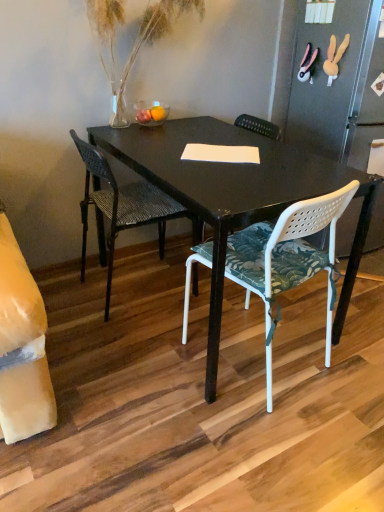
The image size is (384, 512). Find the location of `black woven chair at center, the 2th chair viewed from the right`. black woven chair at center, the 2th chair viewed from the right is located at coordinates (122, 206).

Image resolution: width=384 pixels, height=512 pixels. Describe the element at coordinates (122, 206) in the screenshot. I see `black woven chair at center, the 2th chair viewed from the right` at that location.

Measure the distance between point (101, 207) and camera.

2.01 meters.

What is the approximate height of white plastic chair with floral cushion at center, which ranks as the second chair in left-to-right order?

white plastic chair with floral cushion at center, which ranks as the second chair in left-to-right order, is 30.84 inches in height.

Measure the distance between point [327,364] and camera.

The depth of point [327,364] is 5.59 feet.

How much space does white plastic chair with floral cushion at center, which ranks as the second chair in left-to-right order, occupy horizontally?

white plastic chair with floral cushion at center, which ranks as the second chair in left-to-right order, is 20.03 inches in width.

Describe the element at coordinates (287, 258) in the screenshot. I see `white plastic chair with floral cushion at center, which ranks as the second chair in left-to-right order` at that location.

Identify the location of white plastic chair with floral cushion at center, which ranks as the second chair in left-to-right order. This screenshot has height=512, width=384. 287,258.

Where is `black woven chair at center, the 2th chair viewed from the right`? This screenshot has width=384, height=512. black woven chair at center, the 2th chair viewed from the right is located at coordinates (122, 206).

Can you confirm if black woven chair at center, the 2th chair viewed from the right, is positioned to the left of white plastic chair with floral cushion at center, which ranks as the second chair in left-to-right order?

Correct, you'll find black woven chair at center, the 2th chair viewed from the right, to the left of white plastic chair with floral cushion at center, which ranks as the second chair in left-to-right order.

Which object is more forward, black woven chair at center, placed as the 1th chair when sorted from left to right, or white plastic chair with floral cushion at center, which ranks as the second chair in left-to-right order?

Positioned in front is white plastic chair with floral cushion at center, which ranks as the second chair in left-to-right order.

Does point (176, 203) come behind point (334, 219)?

Yes, it is behind point (334, 219).

Looking at this image, from the image's perspective, is black woven chair at center, placed as the 1th chair when sorted from left to right, located beneath white plastic chair with floral cushion at center, which appears as the 1th chair when viewed from the right?

Actually, black woven chair at center, placed as the 1th chair when sorted from left to right, appears above white plastic chair with floral cushion at center, which appears as the 1th chair when viewed from the right, in the image.

From a real-world perspective, between black woven chair at center, the 2th chair viewed from the right, and white plastic chair with floral cushion at center, which ranks as the second chair in left-to-right order, who is vertically lower?

In real-world perspective, black woven chair at center, the 2th chair viewed from the right, is lower.

Which object is wider, black woven chair at center, placed as the 1th chair when sorted from left to right, or white plastic chair with floral cushion at center, which appears as the 1th chair when viewed from the right?

white plastic chair with floral cushion at center, which appears as the 1th chair when viewed from the right.

Can you confirm if black woven chair at center, placed as the 1th chair when sorted from left to right, is shorter than white plastic chair with floral cushion at center, which appears as the 1th chair when viewed from the right?

No, black woven chair at center, placed as the 1th chair when sorted from left to right, is not shorter than white plastic chair with floral cushion at center, which appears as the 1th chair when viewed from the right.

In terms of size, does black woven chair at center, placed as the 1th chair when sorted from left to right, appear bigger or smaller than white plastic chair with floral cushion at center, which appears as the 1th chair when viewed from the right?

black woven chair at center, placed as the 1th chair when sorted from left to right, is smaller than white plastic chair with floral cushion at center, which appears as the 1th chair when viewed from the right.

Can we say black woven chair at center, placed as the 1th chair when sorted from left to right, lies outside white plastic chair with floral cushion at center, which ranks as the second chair in left-to-right order?

black woven chair at center, placed as the 1th chair when sorted from left to right, is positioned outside white plastic chair with floral cushion at center, which ranks as the second chair in left-to-right order.

Is black woven chair at center, placed as the 1th chair when sorted from left to right, not near white plastic chair with floral cushion at center, which ranks as the second chair in left-to-right order?

That's not correct — black woven chair at center, placed as the 1th chair when sorted from left to right, is a little close to white plastic chair with floral cushion at center, which ranks as the second chair in left-to-right order.

Is black woven chair at center, placed as the 1th chair when sorted from left to right, oriented away from white plastic chair with floral cushion at center, which ranks as the second chair in left-to-right order?

That's not correct — black woven chair at center, placed as the 1th chair when sorted from left to right, is not looking away from white plastic chair with floral cushion at center, which ranks as the second chair in left-to-right order.

Measure the distance from black woven chair at center, placed as the 1th chair when sorted from left to right, to white plastic chair with floral cushion at center, which appears as the 1th chair when viewed from the right.

The distance of black woven chair at center, placed as the 1th chair when sorted from left to right, from white plastic chair with floral cushion at center, which appears as the 1th chair when viewed from the right, is 16.86 inches.

This screenshot has width=384, height=512. In order to click on chair behind the white plastic chair with floral cushion at center, which ranks as the second chair in left-to-right order in this screenshot , I will do `click(122, 206)`.

Visually, is white plastic chair with floral cushion at center, which ranks as the second chair in left-to-right order, positioned to the left or to the right of black woven chair at center, placed as the 1th chair when sorted from left to right?

white plastic chair with floral cushion at center, which ranks as the second chair in left-to-right order, is to the right of black woven chair at center, placed as the 1th chair when sorted from left to right.

Is white plastic chair with floral cushion at center, which ranks as the second chair in left-to-right order, closer to camera compared to black woven chair at center, placed as the 1th chair when sorted from left to right?

Yes, it is.

Considering the positions of points (264, 242) and (86, 152), is point (264, 242) farther from camera compared to point (86, 152)?

That is False.

From the image's perspective, which is below, white plastic chair with floral cushion at center, which ranks as the second chair in left-to-right order, or black woven chair at center, the 2th chair viewed from the right?

white plastic chair with floral cushion at center, which ranks as the second chair in left-to-right order.

From a real-world perspective, who is located higher, white plastic chair with floral cushion at center, which appears as the 1th chair when viewed from the right, or black woven chair at center, placed as the 1th chair when sorted from left to right?

white plastic chair with floral cushion at center, which appears as the 1th chair when viewed from the right.

Can you confirm if white plastic chair with floral cushion at center, which appears as the 1th chair when viewed from the right, is wider than black woven chair at center, placed as the 1th chair when sorted from left to right?

Yes.

Considering the sizes of objects white plastic chair with floral cushion at center, which appears as the 1th chair when viewed from the right, and black woven chair at center, the 2th chair viewed from the right, in the image provided, who is taller, white plastic chair with floral cushion at center, which appears as the 1th chair when viewed from the right, or black woven chair at center, the 2th chair viewed from the right,?

With more height is black woven chair at center, the 2th chair viewed from the right.

Is white plastic chair with floral cushion at center, which ranks as the second chair in left-to-right order, smaller than black woven chair at center, placed as the 1th chair when sorted from left to right?

No, white plastic chair with floral cushion at center, which ranks as the second chair in left-to-right order, is not smaller than black woven chair at center, placed as the 1th chair when sorted from left to right.

Is white plastic chair with floral cushion at center, which ranks as the second chair in left-to-right order, inside or outside of black woven chair at center, the 2th chair viewed from the right?

white plastic chair with floral cushion at center, which ranks as the second chair in left-to-right order, is spatially situated outside black woven chair at center, the 2th chair viewed from the right.

Looking at this image, is white plastic chair with floral cushion at center, which ranks as the second chair in left-to-right order, not near black woven chair at center, the 2th chair viewed from the right?

No, white plastic chair with floral cushion at center, which ranks as the second chair in left-to-right order, is not far from black woven chair at center, the 2th chair viewed from the right.

Is white plastic chair with floral cushion at center, which appears as the 1th chair when viewed from the right, oriented towards black woven chair at center, placed as the 1th chair when sorted from left to right?

Yes, white plastic chair with floral cushion at center, which appears as the 1th chair when viewed from the right, is facing black woven chair at center, placed as the 1th chair when sorted from left to right.

Identify the location of chair in front of the black woven chair at center, placed as the 1th chair when sorted from left to right. (287, 258).

I want to click on chair behind the white plastic chair with floral cushion at center, which appears as the 1th chair when viewed from the right, so click(x=122, y=206).

The height and width of the screenshot is (512, 384). Find the location of `chair located below the black woven chair at center, placed as the 1th chair when sorted from left to right (from the image's perspective)`. chair located below the black woven chair at center, placed as the 1th chair when sorted from left to right (from the image's perspective) is located at coordinates (287, 258).